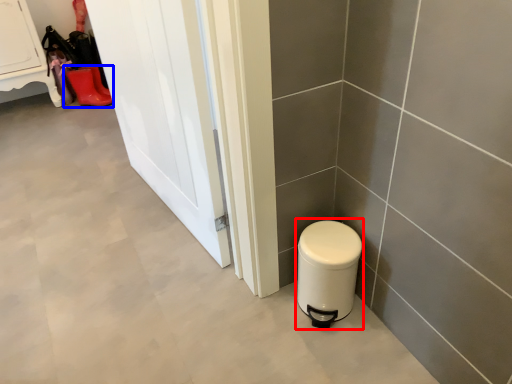
Question: Which point is closer to the camera, water heater (highlighted by a red box) or footwear (highlighted by a blue box)?

Choices:
 (A) water heater
 (B) footwear

Answer: (A)